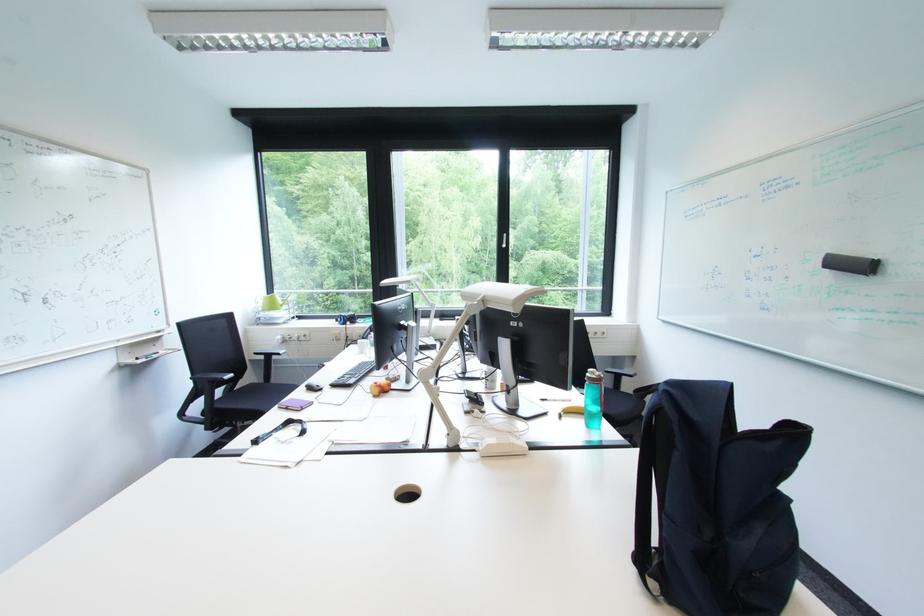
Locate an element on the screen. blue bottle cap is located at coordinates (407, 493).